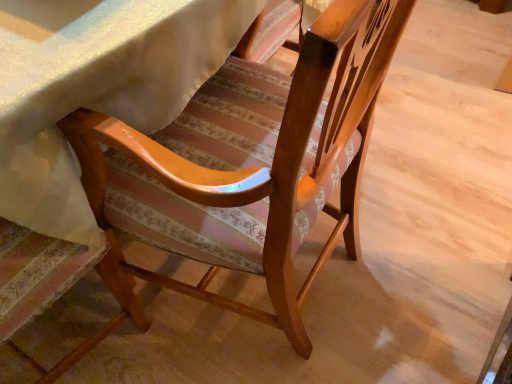
The height and width of the screenshot is (384, 512). Find the location of `glossy wood chair at center`. glossy wood chair at center is located at coordinates (247, 164).

Measure the distance between glossy wood chair at center and camera.

glossy wood chair at center and camera are 12.95 inches apart from each other.

What do you see at coordinates (247, 164) in the screenshot?
I see `glossy wood chair at center` at bounding box center [247, 164].

You are a GUI agent. You are given a task and a screenshot of the screen. Output one action in this format:
    pyautogui.click(x=<x>, y=<y>)
    Task: Click on the glossy wood chair at center
    
    Given the screenshot: What is the action you would take?
    pyautogui.click(x=247, y=164)